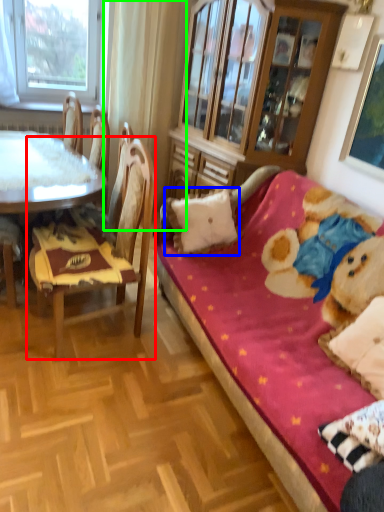
Question: Based on their relative distances, which object is nearer to chair (highlighted by a red box)? Choose from pillow (highlighted by a blue box) and curtain (highlighted by a green box).

Choices:
 (A) pillow
 (B) curtain

Answer: (A)